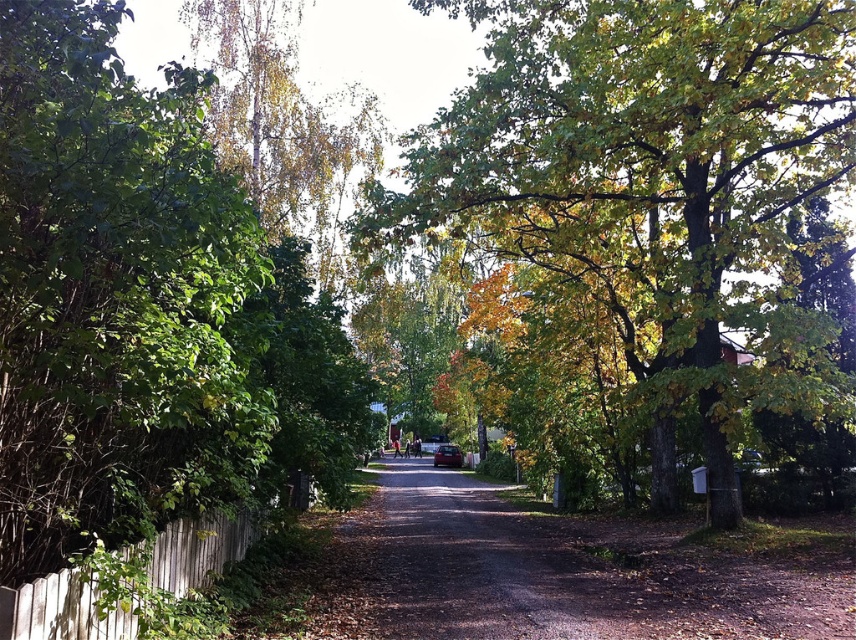
Who is positioned more to the right, green leafy tree at center or metallic silver car at center?

green leafy tree at center is more to the right.

Is green leafy tree at center to the left of metallic silver car at center from the viewer's perspective?

In fact, green leafy tree at center is to the right of metallic silver car at center.

Is point (476, 212) more distant than point (450, 452)?

That is False.

Identify the location of green leafy tree at center. (643, 156).

Is the position of green leafy tree at left more distant than that of green leafy tree at center?

No, it is not.

Which of these two, green leafy tree at left or green leafy tree at center, stands taller?

green leafy tree at center

What do you see at coordinates (141, 307) in the screenshot? I see `green leafy tree at left` at bounding box center [141, 307].

In order to click on green leafy tree at left in this screenshot , I will do `click(141, 307)`.

Can you confirm if green leafy tree at left is taller than white wooden fence at lower left?

Correct, green leafy tree at left is much taller as white wooden fence at lower left.

Find the location of a particular element. Image resolution: width=856 pixels, height=640 pixels. green leafy tree at left is located at coordinates (141, 307).

Which is in front, point (269, 468) or point (33, 634)?

Point (33, 634) is in front.

Locate an element on the screen. green leafy tree at left is located at coordinates (141, 307).